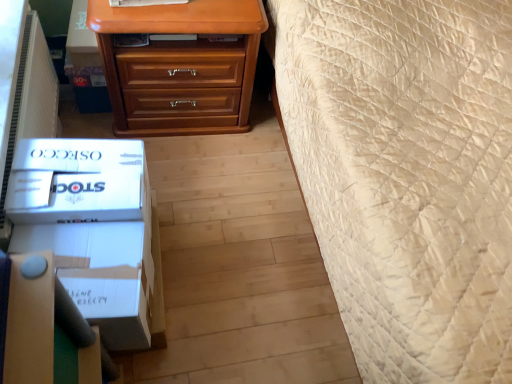
Question: Is white cardboard box at lower left, which is the first box in top-to-bottom order, at the right side of matte wood chest of drawers at upper center?

Choices:
 (A) no
 (B) yes

Answer: (A)

Question: Is white cardboard box at lower left, which is the first box in top-to-bottom order, closer to camera compared to matte wood chest of drawers at upper center?

Choices:
 (A) yes
 (B) no

Answer: (A)

Question: Is white cardboard box at lower left, which is counted as the 2th box, starting from the bottom, outside matte wood chest of drawers at upper center?

Choices:
 (A) no
 (B) yes

Answer: (B)

Question: Would you consider white cardboard box at lower left, which is counted as the 2th box, starting from the bottom, to be distant from matte wood chest of drawers at upper center?

Choices:
 (A) yes
 (B) no

Answer: (B)

Question: Can you confirm if white cardboard box at lower left, which is the first box in top-to-bottom order, is smaller than matte wood chest of drawers at upper center?

Choices:
 (A) no
 (B) yes

Answer: (B)

Question: Based on their sizes in the image, would you say white cardboard box at lower left, which is the 1th box in bottom-to-top order, is bigger or smaller than white cardboard box at lower left, which is the first box in top-to-bottom order?

Choices:
 (A) small
 (B) big

Answer: (B)

Question: Considering the positions of point (31, 218) and point (61, 218), is point (31, 218) closer or farther from the camera than point (61, 218)?

Choices:
 (A) farther
 (B) closer

Answer: (B)

Question: Considering the positions of white cardboard box at lower left, positioned as the 2th box in top-to-bottom order, and white cardboard box at lower left, which is the first box in top-to-bottom order, in the image, is white cardboard box at lower left, positioned as the 2th box in top-to-bottom order, taller or shorter than white cardboard box at lower left, which is the first box in top-to-bottom order,?

Choices:
 (A) short
 (B) tall

Answer: (A)

Question: Which is correct: white cardboard box at lower left, positioned as the 2th box in top-to-bottom order, is inside white cardboard box at lower left, which is counted as the 2th box, starting from the bottom, or outside of it?

Choices:
 (A) outside
 (B) inside

Answer: (A)

Question: Is point (83, 279) positioned closer to the camera than point (243, 130)?

Choices:
 (A) farther
 (B) closer

Answer: (B)

Question: Considering the positions of white cardboard box at lower left, which is the 1th box in bottom-to-top order, and matte wood chest of drawers at upper center in the image, is white cardboard box at lower left, which is the 1th box in bottom-to-top order, bigger or smaller than matte wood chest of drawers at upper center?

Choices:
 (A) small
 (B) big

Answer: (A)

Question: From the image's perspective, is white cardboard box at lower left, which is the 1th box in bottom-to-top order, positioned above or below matte wood chest of drawers at upper center?

Choices:
 (A) above
 (B) below

Answer: (B)

Question: Do you think white cardboard box at lower left, which is the 1th box in bottom-to-top order, is within matte wood chest of drawers at upper center, or outside of it?

Choices:
 (A) outside
 (B) inside

Answer: (A)

Question: From the image's perspective, is white cardboard box at lower left, which is the first box in top-to-bottom order, above or below white cardboard box at lower left, which is the 1th box in bottom-to-top order?

Choices:
 (A) below
 (B) above

Answer: (B)

Question: Choose the correct answer: Is white cardboard box at lower left, which is the first box in top-to-bottom order, inside white cardboard box at lower left, positioned as the 2th box in top-to-bottom order, or outside it?

Choices:
 (A) inside
 (B) outside

Answer: (B)